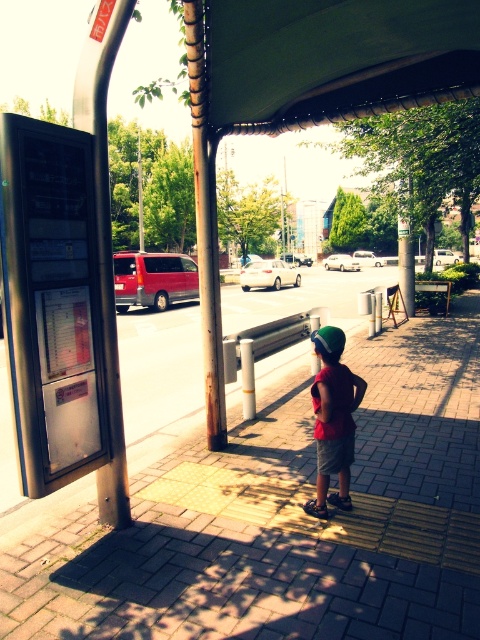
Is brick pavement at center above green matte baseball hat at center?

No.

Who is more forward, (261, 476) or (337, 340)?

Point (337, 340) is in front.

Is point (134, 513) positioned in front of point (324, 337)?

That is False.

I want to click on brick pavement at center, so click(287, 518).

Based on the photo, is green fabric canopy at upper center closer to the viewer compared to green matte baseball hat at center?

Yes, it is in front of green matte baseball hat at center.

Who is taller, green fabric canopy at upper center or green matte baseball hat at center?

green fabric canopy at upper center is taller.

This screenshot has width=480, height=640. Describe the element at coordinates (334, 60) in the screenshot. I see `green fabric canopy at upper center` at that location.

The image size is (480, 640). I want to click on green fabric canopy at upper center, so click(334, 60).

Between green fabric canopy at upper center and matte red shirt at center, which one appears on the left side from the viewer's perspective?

green fabric canopy at upper center is more to the left.

Can you confirm if green fabric canopy at upper center is taller than matte red shirt at center?

Incorrect, green fabric canopy at upper center's height is not larger of matte red shirt at center's.

Is point (448, 24) positioned in front of point (320, 488)?

Yes.

You are a GUI agent. You are given a task and a screenshot of the screen. Output one action in this format:
    pyautogui.click(x=<x>, y=<y>)
    Task: Click on the green fabric canopy at upper center
    
    Given the screenshot: What is the action you would take?
    pyautogui.click(x=334, y=60)